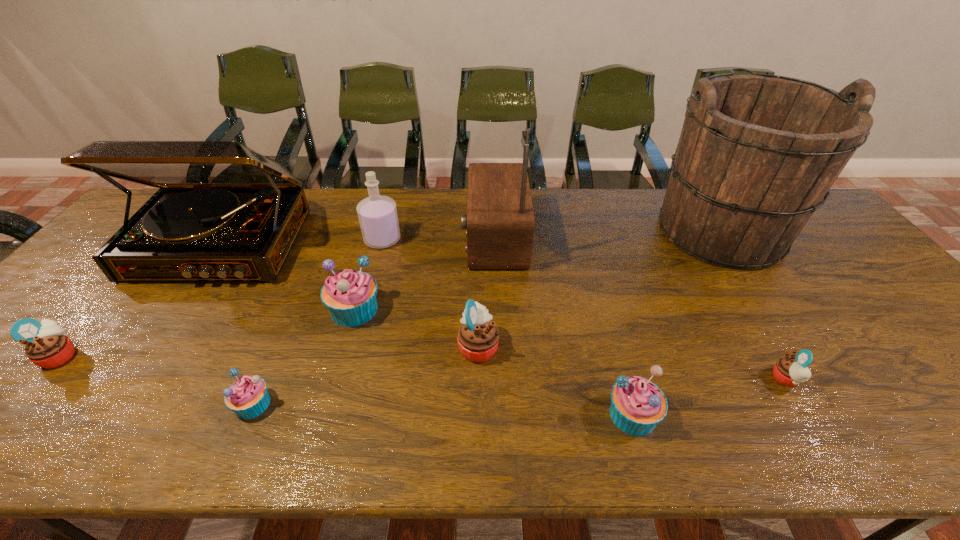
Find the location of a particular element. free spot located 0.400m on the front-facing side of the radio receiver is located at coordinates (333, 238).

Where is `vacant area situated on the front-facing side of the record player`? The width and height of the screenshot is (960, 540). vacant area situated on the front-facing side of the record player is located at coordinates (124, 388).

This screenshot has width=960, height=540. Identify the location of free point located on the right of the perfume. (479, 240).

Where is `vacant point located on the right of the third muffin from left to right`? The image size is (960, 540). vacant point located on the right of the third muffin from left to right is located at coordinates (505, 309).

This screenshot has height=540, width=960. I want to click on free space located on the front-facing side of the second pink muffin from left to right, so click(x=554, y=346).

Locate an element on the screen. free space located 0.130m on the front-facing side of the leftmost pink muffin is located at coordinates (132, 355).

This screenshot has width=960, height=540. I want to click on free space located 0.390m on the back of the second muffin from right to left, so click(x=593, y=271).

Locate an element on the screen. vacant space located 0.200m on the front-facing side of the rightmost pink muffin is located at coordinates (683, 379).

Image resolution: width=960 pixels, height=540 pixels. Identify the location of vacant space situated 0.200m on the front-facing side of the rightmost pink muffin. (683, 379).

The image size is (960, 540). I want to click on blank area located 0.130m on the front-facing side of the rightmost pink muffin, so click(714, 379).